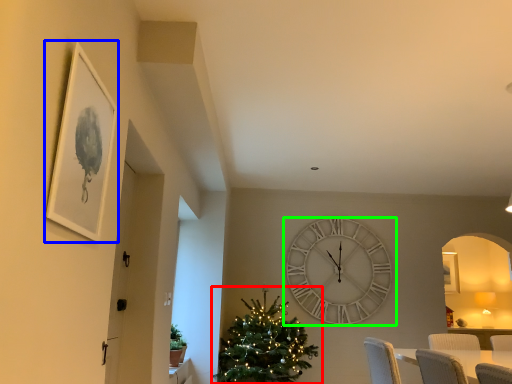
Question: Based on their relative distances, which object is nearer to christmas tree (highlighted by a red box)? Choose from picture frame (highlighted by a blue box) and wall clock (highlighted by a green box).

Choices:
 (A) picture frame
 (B) wall clock

Answer: (B)